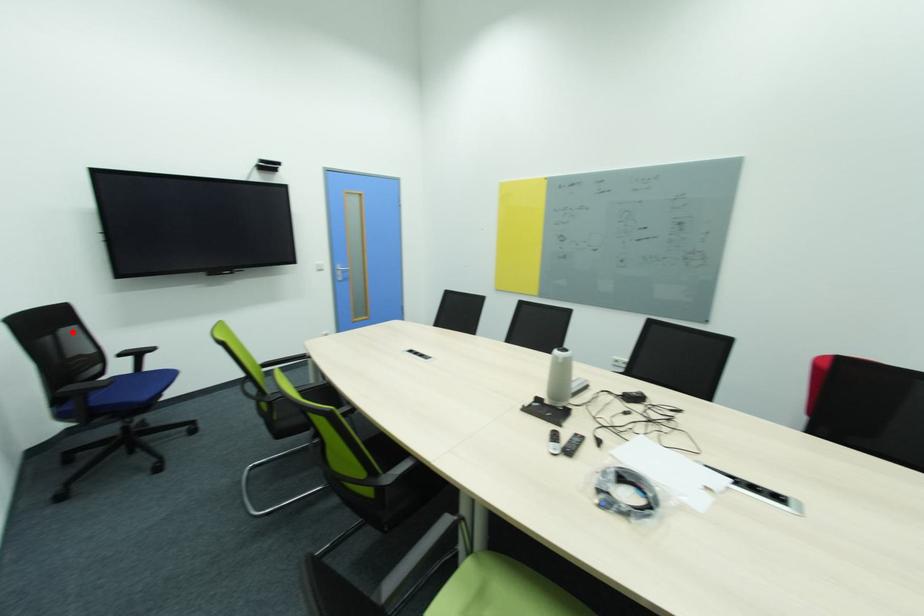
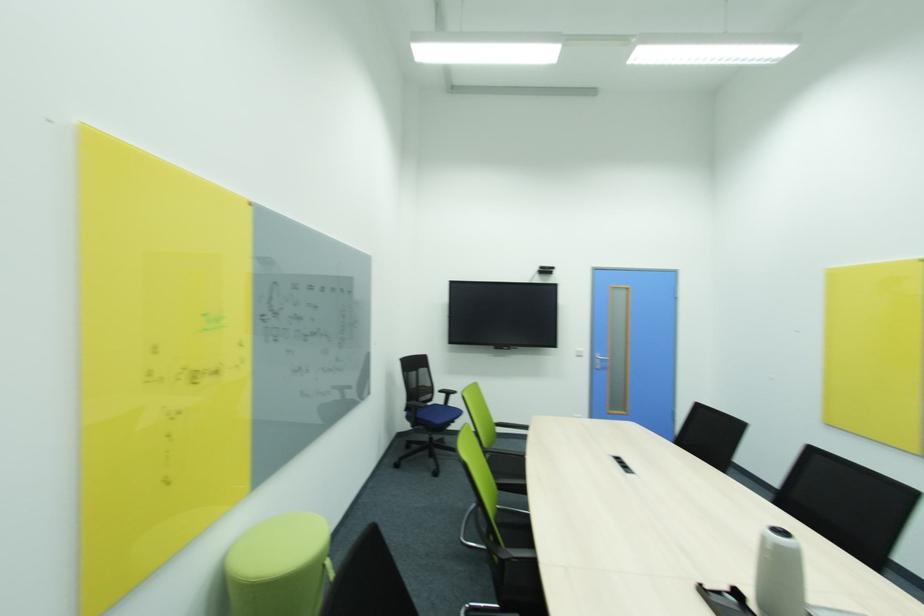
Question: I am providing you with two images of the same scene from different viewpoints. A red point is marked on the first image. Is the red point's position out of view in image 2?

Choices:
 (A) Yes
 (B) No

Answer: (B)